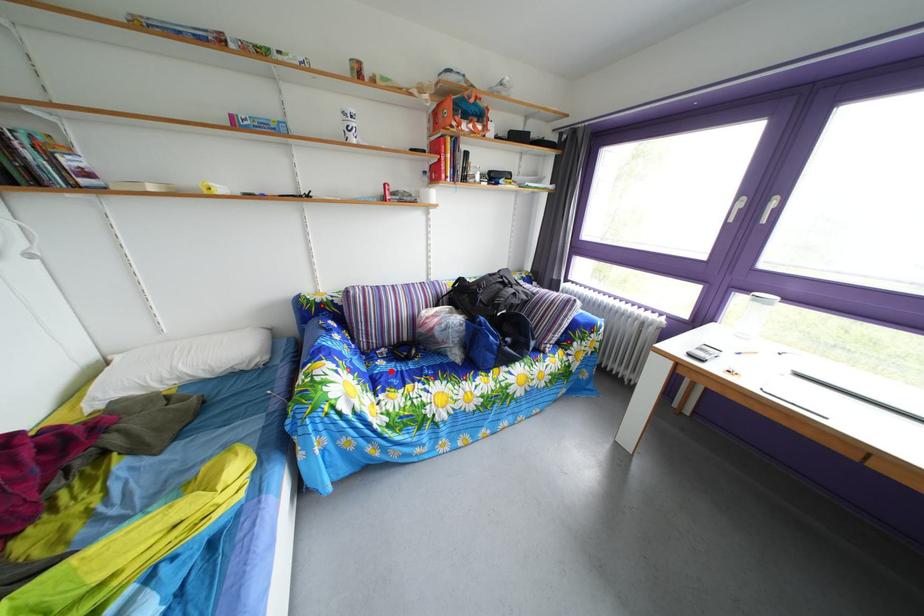
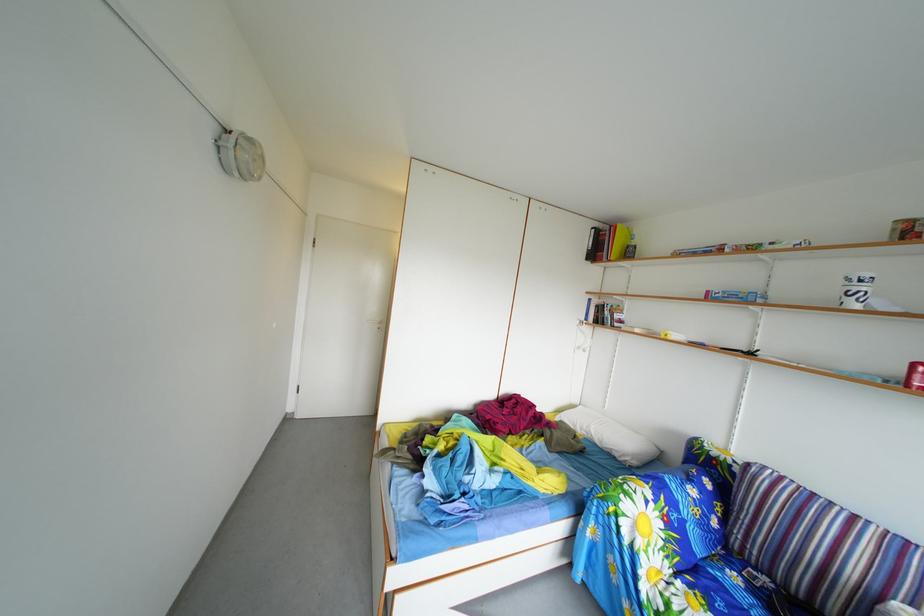
Locate, in the second image, the point that corresponds to the highlighted location in the first image.

(746, 585)